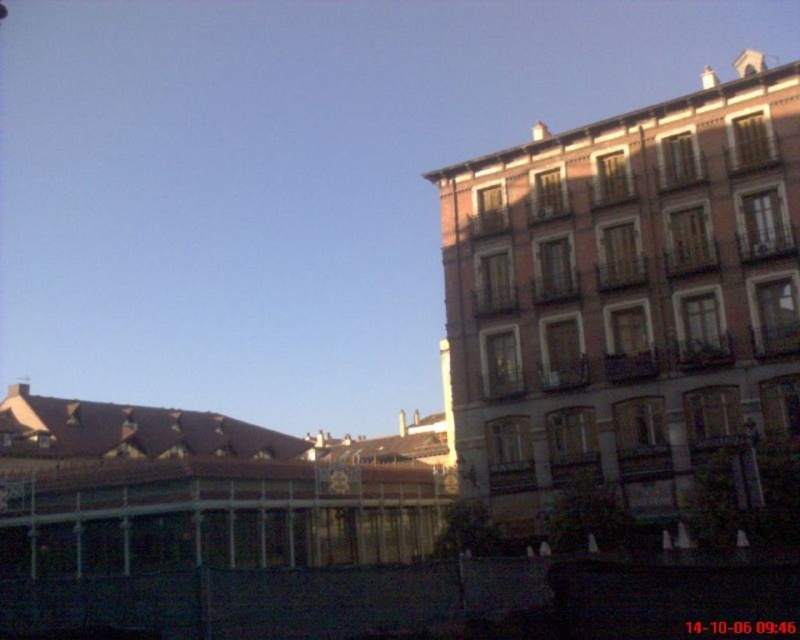
Question: Does metallic gold clock at center have a greater width compared to metallic gold clock at center-right?

Choices:
 (A) no
 (B) yes

Answer: (A)

Question: Among these objects, which one is nearest to the camera?

Choices:
 (A) metallic gold clock at center
 (B) metallic gold clock at center-right

Answer: (A)

Question: Among these objects, which one is farthest from the camera?

Choices:
 (A) metallic gold clock at center-right
 (B) metallic gold clock at center
 (C) red brick building at right

Answer: (A)

Question: Which of these objects is positioned closest to the metallic gold clock at center?

Choices:
 (A) metallic gold clock at center-right
 (B) red brick building at right

Answer: (A)

Question: Is red brick building at right smaller than metallic gold clock at center-right?

Choices:
 (A) no
 (B) yes

Answer: (A)

Question: Considering the relative positions of red brick building at right and metallic gold clock at center in the image provided, where is red brick building at right located with respect to metallic gold clock at center?

Choices:
 (A) above
 (B) below

Answer: (A)